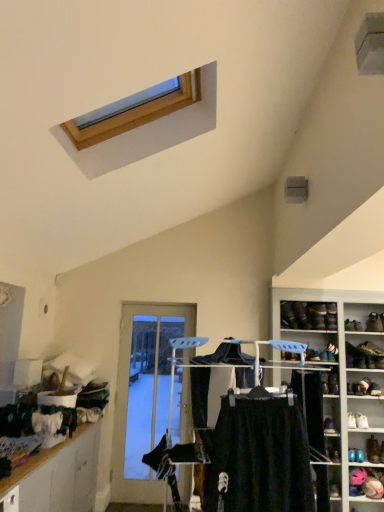
Question: From the image's perspective, is black matte skirt at center positioned above or below wooden cabinet at lower left?

Choices:
 (A) above
 (B) below

Answer: (A)

Question: Visually, is black matte skirt at center positioned to the left or to the right of wooden cabinet at lower left?

Choices:
 (A) right
 (B) left

Answer: (A)

Question: Which is farther from the velvet pink hat at lower right, which appears as the first shelf when viewed from the right?

Choices:
 (A) white leather shoe at lower right, which is the 4th footwear in top-to-bottom order
 (B) matte black shoe at upper right, which appears as the third shoe when viewed from the right
 (C) white leather shoe at lower right, arranged as the fifth footwear when viewed from the top
 (D) leather shoe at right, acting as the second shoe starting from the bottom
 (E) black matte skirt at center

Answer: (E)

Question: Which is farther from the white leather shoe at lower right, arranged as the fifth footwear when viewed from the top?

Choices:
 (A) leather boot at right, the 5th shoe in the bottom-to-top sequence
 (B) velvet pink hat at lower right, which is counted as the second shelf, starting from the left
 (C) white leather shoe at lower right, which is the 4th footwear in top-to-bottom order
 (D) black leather shoe at upper right, which is counted as the 2th shoe, starting from the top
 (E) black leather shoe at upper right, which is the 6th shoe in right-to-left order

Answer: (C)